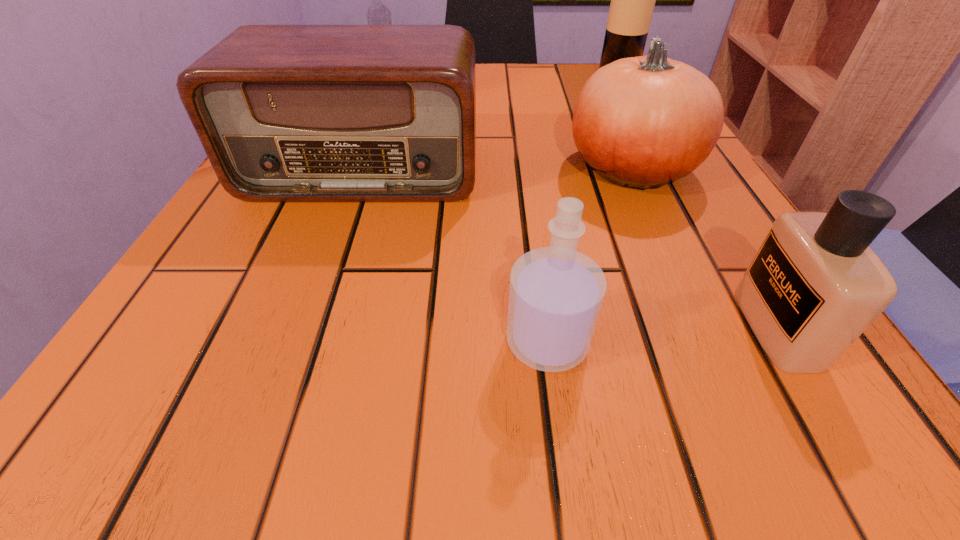
Where is `wine bottle`? This screenshot has width=960, height=540. wine bottle is located at coordinates (632, 4).

The width and height of the screenshot is (960, 540). I want to click on vodka, so click(377, 14).

This screenshot has width=960, height=540. I want to click on pumpkin, so click(x=642, y=122).

I want to click on radio receiver, so click(x=285, y=113).

Identify the location of the left perfume. This screenshot has height=540, width=960. (556, 293).

In order to click on the right perfume in this screenshot , I will do `click(814, 286)`.

Identify the location of free space located on the front of the tallest object. (632, 100).

Where is `blank space located on the right of the vodka`? The width and height of the screenshot is (960, 540). blank space located on the right of the vodka is located at coordinates (442, 75).

At what (x,y) coordinates should I click in order to perform the action: click on vacant region located on the back of the pumpkin. Please return your answer as a coordinate pair (x, y). This screenshot has width=960, height=540. Looking at the image, I should click on (592, 82).

I want to click on vacant space located 0.150m on the front panel of the radio receiver, so click(x=327, y=273).